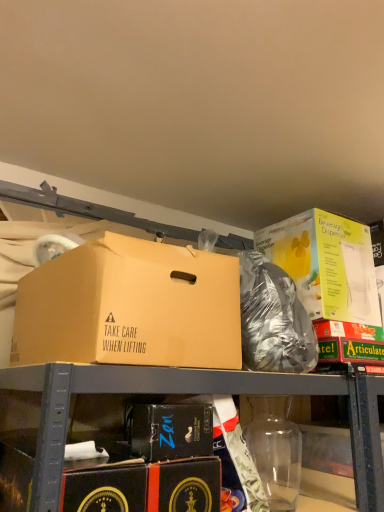
Question: Is black cardboard box at lower center, which is counted as the 2th box, starting from the left, bigger than transparent plastic bottle at lower center?

Choices:
 (A) yes
 (B) no

Answer: (B)

Question: From a real-world perspective, is black cardboard box at lower center, placed as the 2th box when sorted from right to left, below transparent plastic bottle at lower center?

Choices:
 (A) yes
 (B) no

Answer: (B)

Question: Considering the relative positions of black cardboard box at lower center, placed as the 2th box when sorted from right to left, and transparent plastic bottle at lower center in the image provided, is black cardboard box at lower center, placed as the 2th box when sorted from right to left, in front of transparent plastic bottle at lower center?

Choices:
 (A) yes
 (B) no

Answer: (A)

Question: Can you see black cardboard box at lower center, placed as the 2th box when sorted from right to left, touching transparent plastic bottle at lower center?

Choices:
 (A) no
 (B) yes

Answer: (A)

Question: Is the position of black cardboard box at lower center, placed as the 2th box when sorted from right to left, more distant than that of transparent plastic bottle at lower center?

Choices:
 (A) yes
 (B) no

Answer: (B)

Question: In terms of height, does black cardboard box at lower center, which is counted as the 2th box, starting from the left, look taller or shorter compared to transparent plastic bottle at lower center?

Choices:
 (A) short
 (B) tall

Answer: (A)

Question: Considering their positions, is black cardboard box at lower center, placed as the 2th box when sorted from right to left, located in front of or behind transparent plastic bottle at lower center?

Choices:
 (A) front
 (B) behind

Answer: (A)

Question: Is black cardboard box at lower center, placed as the 2th box when sorted from right to left, to the left or to the right of transparent plastic bottle at lower center in the image?

Choices:
 (A) right
 (B) left

Answer: (B)

Question: From a real-world perspective, is black cardboard box at lower center, which is counted as the 2th box, starting from the left, above or below transparent plastic bottle at lower center?

Choices:
 (A) above
 (B) below

Answer: (A)

Question: Does point (67, 285) appear closer or farther from the camera than point (147, 460)?

Choices:
 (A) closer
 (B) farther

Answer: (B)

Question: Considering the positions of matte cardboard box at upper left, which appears as the 3th box when viewed from the right, and black cardboard box at lower center, which is counted as the 2th box, starting from the left, in the image, is matte cardboard box at upper left, which appears as the 3th box when viewed from the right, wider or thinner than black cardboard box at lower center, which is counted as the 2th box, starting from the left,?

Choices:
 (A) thin
 (B) wide

Answer: (B)

Question: From their relative heights in the image, would you say matte cardboard box at upper left, which appears as the 3th box when viewed from the right, is taller or shorter than black cardboard box at lower center, placed as the 2th box when sorted from right to left?

Choices:
 (A) short
 (B) tall

Answer: (B)

Question: From the image's perspective, relative to black cardboard box at lower center, placed as the 2th box when sorted from right to left, is matte cardboard box at upper left, placed as the 1th box when sorted from left to right, above or below?

Choices:
 (A) above
 (B) below

Answer: (A)

Question: Do you think matte cardboard box at upper left, which appears as the 3th box when viewed from the right, is within yellow cardboard beverage dispenser at upper right, which is the 1th box from right to left, or outside of it?

Choices:
 (A) inside
 (B) outside

Answer: (B)

Question: Does point (104, 346) appear closer or farther from the camera than point (296, 239)?

Choices:
 (A) farther
 (B) closer

Answer: (B)